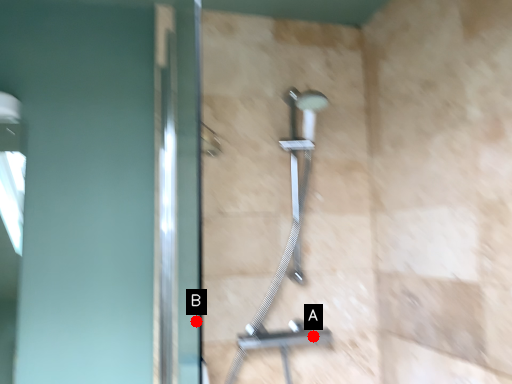
Question: Two points are circled on the image, labeled by A and B beside each circle. Which point appears farthest from the camera in this image?

Choices:
 (A) A is further
 (B) B is further

Answer: (B)